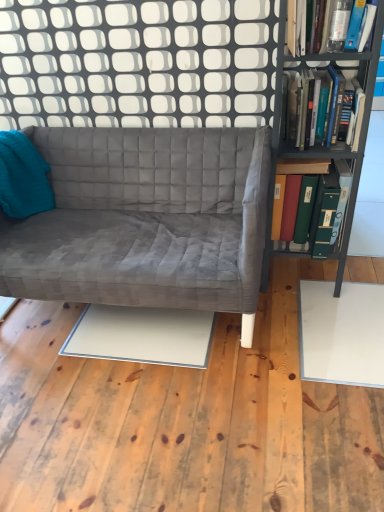
Identify the location of free space above hardcover books at right, which is the 2th book from bottom to top (from a real-world perspective). (320, 69).